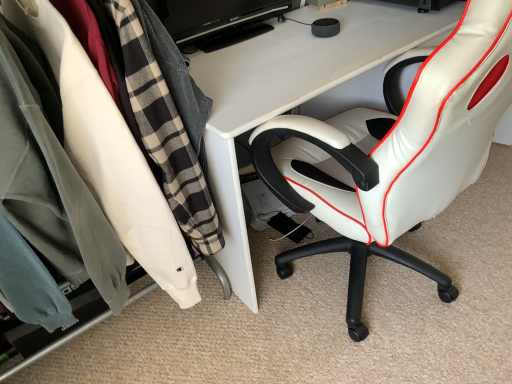
Question: Would you say matte white clothing rack at left contains white leather chair at right?

Choices:
 (A) no
 (B) yes

Answer: (A)

Question: Is matte white clothing rack at left thinner than white leather chair at right?

Choices:
 (A) yes
 (B) no

Answer: (A)

Question: Is matte white clothing rack at left further to camera compared to white leather chair at right?

Choices:
 (A) yes
 (B) no

Answer: (A)

Question: Considering the relative positions of matte white clothing rack at left and white leather chair at right in the image provided, is matte white clothing rack at left in front of white leather chair at right?

Choices:
 (A) no
 (B) yes

Answer: (A)

Question: Considering the relative sizes of matte white clothing rack at left and white leather chair at right in the image provided, is matte white clothing rack at left wider than white leather chair at right?

Choices:
 (A) no
 (B) yes

Answer: (A)

Question: Is matte white clothing rack at left bigger than white leather chair at right?

Choices:
 (A) no
 (B) yes

Answer: (A)

Question: Does white leather chair at right appear on the right side of matte white clothing rack at left?

Choices:
 (A) no
 (B) yes

Answer: (B)

Question: Can you confirm if white leather chair at right is thinner than matte white clothing rack at left?

Choices:
 (A) no
 (B) yes

Answer: (A)

Question: Could matte white clothing rack at left be considered to be inside white leather chair at right?

Choices:
 (A) yes
 (B) no

Answer: (B)

Question: Can you confirm if white leather chair at right is wider than matte white clothing rack at left?

Choices:
 (A) yes
 (B) no

Answer: (A)

Question: From the image's perspective, is white leather chair at right over matte white clothing rack at left?

Choices:
 (A) no
 (B) yes

Answer: (B)

Question: Is there a large distance between white leather chair at right and matte white clothing rack at left?

Choices:
 (A) yes
 (B) no

Answer: (B)

Question: From the image's perspective, would you say black glossy monitor at upper center is shown under matte white clothing rack at left?

Choices:
 (A) yes
 (B) no

Answer: (B)